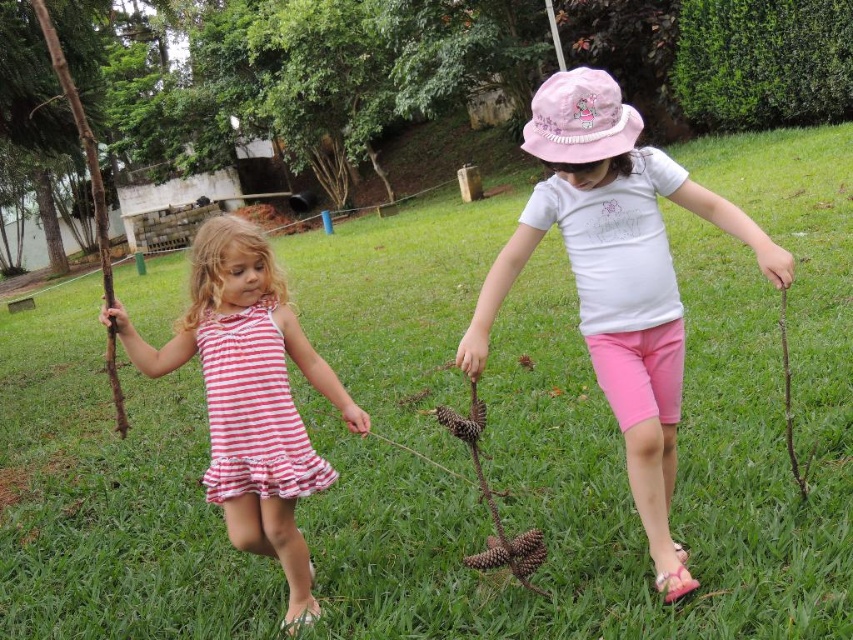
Question: Does striped fabric dress at left appear under brown rough twig at right?

Choices:
 (A) no
 (B) yes

Answer: (B)

Question: Among these objects, which one is nearest to the camera?

Choices:
 (A) brown rough twig at right
 (B) striped fabric dress at left

Answer: (A)

Question: Observing the image, what is the correct spatial positioning of pink striped dress at center in reference to brown rough twig at right?

Choices:
 (A) left
 (B) right

Answer: (A)

Question: Which of the following is the farthest from the observer?

Choices:
 (A) (792, 416)
 (B) (199, 260)
 (C) (288, 390)

Answer: (A)

Question: Which point is closer to the camera?

Choices:
 (A) (254, 404)
 (B) (782, 396)
 (C) (289, 454)
 (D) (643, 404)

Answer: (D)

Question: Can you confirm if pink cotton hat at center is wider than brown rough twig at right?

Choices:
 (A) yes
 (B) no

Answer: (A)